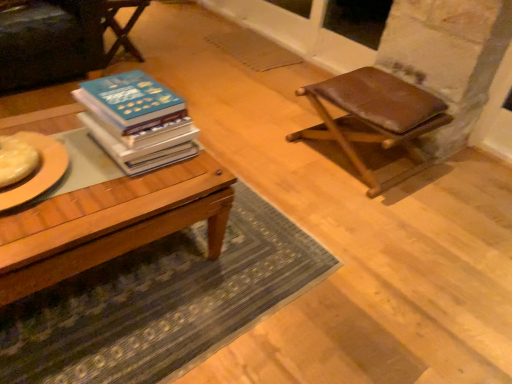
Identify the location of vacant space that is to the left of brown leather stool at right. (264, 142).